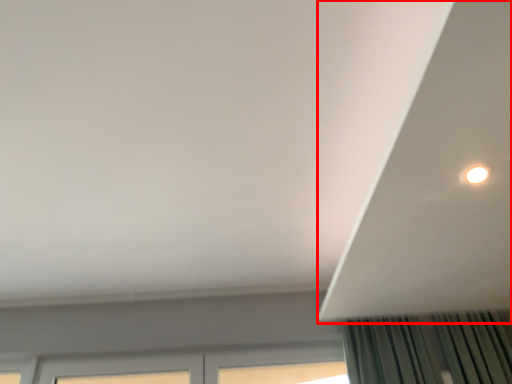
Question: In this image, where is exhaust hood (annotated by the red box) located relative to window?

Choices:
 (A) left
 (B) right

Answer: (B)